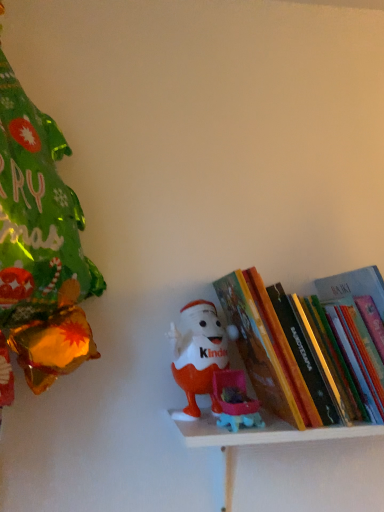
Question: In terms of height, does plastic toy at center look taller or shorter compared to hardcover book at center?

Choices:
 (A) tall
 (B) short

Answer: (B)

Question: Based on their positions, is plastic toy at center located to the left or right of hardcover book at center?

Choices:
 (A) left
 (B) right

Answer: (A)

Question: Which object is positioned farthest from the hardcover book at center?

Choices:
 (A) matte plastic toy at center
 (B) plastic toy at center

Answer: (A)

Question: Which object is positioned closest to the plastic toy at center?

Choices:
 (A) matte plastic toy at center
 (B) hardcover book at center

Answer: (A)